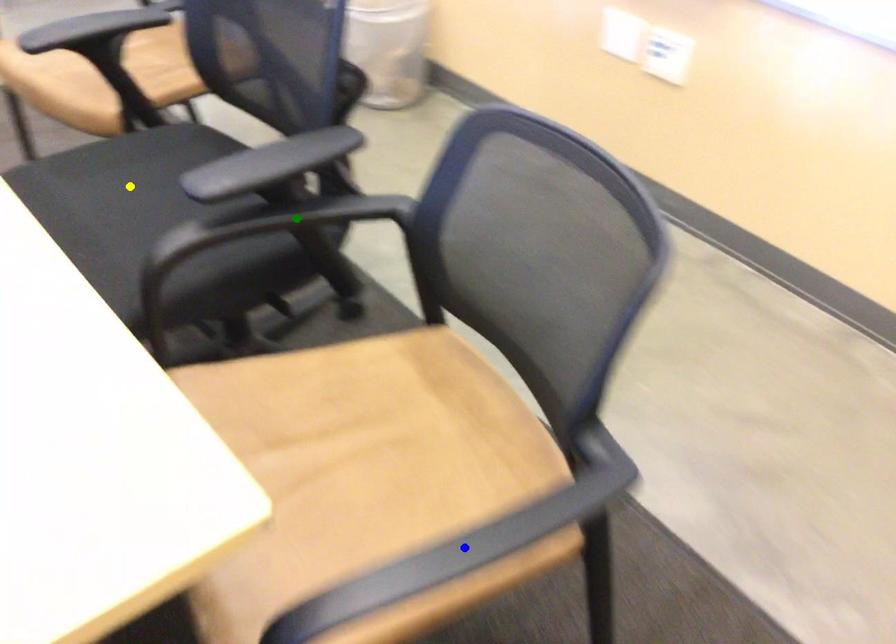
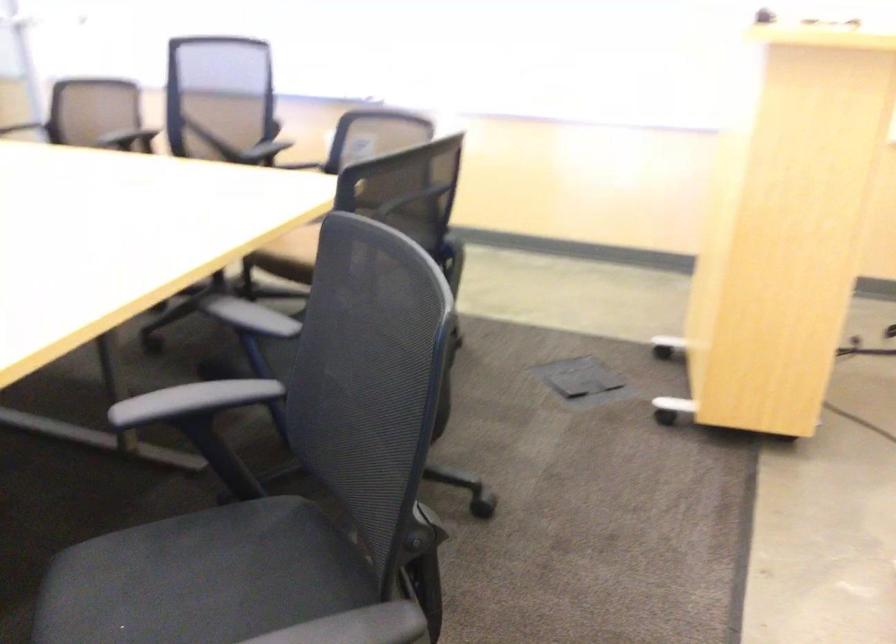
I am providing you with two images of the same scene from different viewpoints. Three points are marked in image1. Which point corresponds to a part or object that is occluded in image2?In image1, three points are marked. Which of them correspond to a part or object that is occluded in image2?Among the three points shown in image1, which one corresponds to a part or object that is no longer visible due to occlusion in image2?

yellow point, blue point, green point